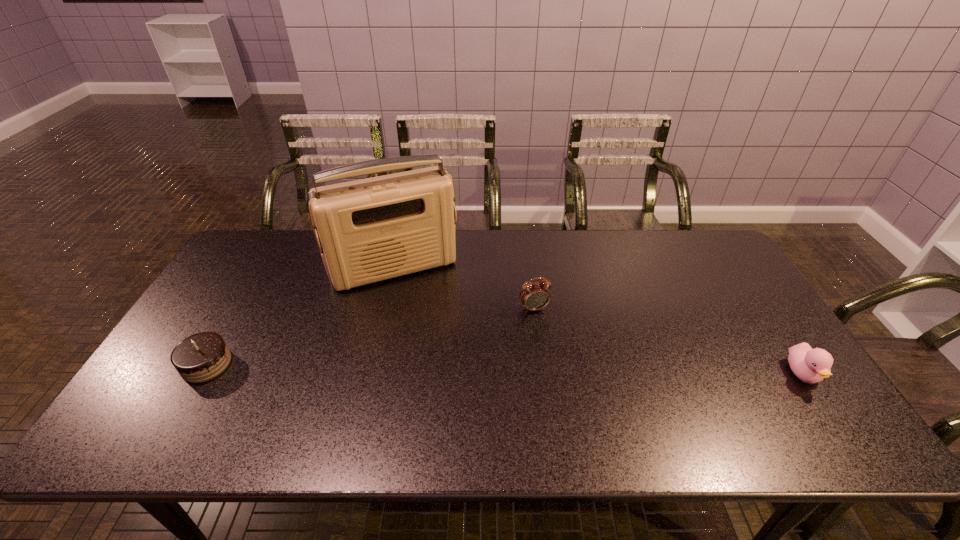
Identify the location of object that is at the near right corner. The image size is (960, 540). (810, 365).

Identify the location of vacant region at the far edge. (640, 254).

This screenshot has height=540, width=960. In the image, there is a desktop. In order to click on vacant space at the near edge in this screenshot , I will do `click(523, 395)`.

Locate an element on the screen. This screenshot has height=540, width=960. vacant region at the left edge of the desktop is located at coordinates (235, 307).

Find the location of a particular element. The image size is (960, 540). vacant space at the right edge is located at coordinates (690, 278).

At what (x,y) coordinates should I click in order to perform the action: click on vacant region at the far left corner of the desktop. Please return your answer as a coordinate pair (x, y). Looking at the image, I should click on (262, 269).

In the image, there is a desktop. Where is `vacant space at the far right corner`? The height and width of the screenshot is (540, 960). vacant space at the far right corner is located at coordinates (715, 245).

The image size is (960, 540). Identify the location of vacant space that is in between the alarm clock and the rightmost object. (668, 341).

The height and width of the screenshot is (540, 960). I want to click on free space between the tallest object and the chocolate cake, so click(300, 316).

At what (x,y) coordinates should I click in order to perform the action: click on blank region between the rightmost object and the chocolate cake. Please return your answer as a coordinate pair (x, y). The height and width of the screenshot is (540, 960). Looking at the image, I should click on (505, 369).